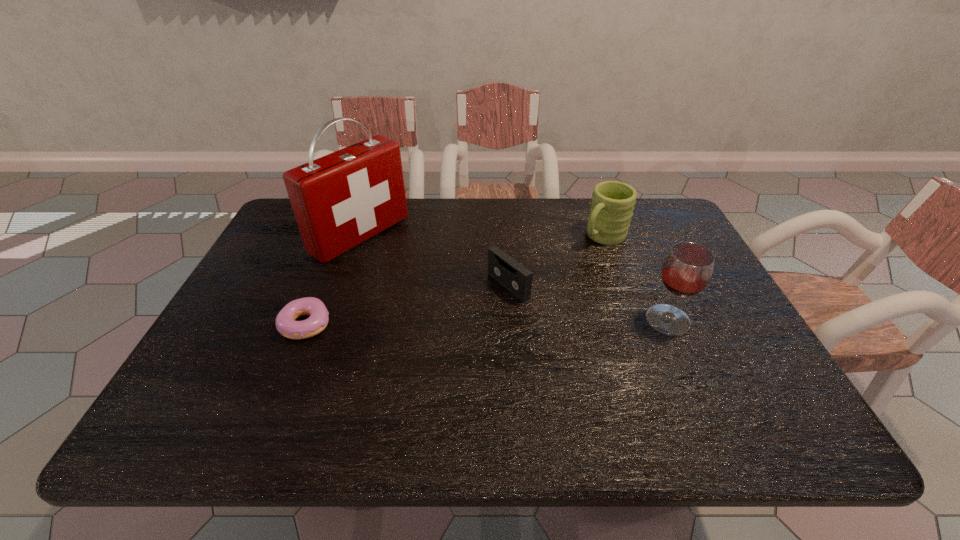
At what (x,y) coordinates should I click in order to perform the action: click on free space on the desktop that is between the doughnut and the wineglass and is positioned on the side of the mug with the handle. Please return your answer as a coordinate pair (x, y). Looking at the image, I should click on (495, 322).

The width and height of the screenshot is (960, 540). I want to click on free spot on the desktop that is between the doughnut and the wineglass and is positioned on the front face of the first-aid kit, so click(503, 322).

The width and height of the screenshot is (960, 540). I want to click on free space on the desktop that is between the doughnut and the wineglass and is positioned on the front-facing side of the third object from left to right, so pyautogui.click(x=444, y=323).